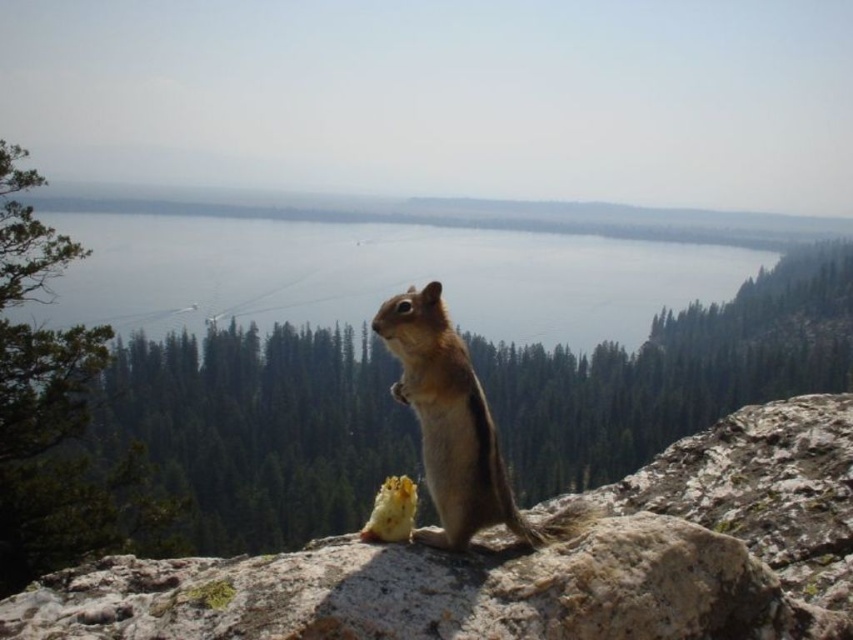
You are a photographer standing at the edge of the lake, and you want to take a photo of the gray rock at center and the brown furry squirrel at center. Which object will appear larger in the photo?

The gray rock at center will appear larger in the photo because it is closer to the viewer than the brown furry squirrel at center.

You are a photographer trying to capture the brown furry squirrel at center and the gray rock at center in a single frame. Based on their positions, which object is located to the right of the other?

The gray rock at center is positioned on the right side of brown furry squirrel at center, so the gray rock at center is to the right of the brown furry squirrel at center.

You are standing at the chipmunk location and want to move towards the point with coordinates point (573, 508). Is the point point (386, 563) between you and that point?

Yes, the point (386, 563) is between you and the point (573, 508) because it is closer to the viewer than the other point.